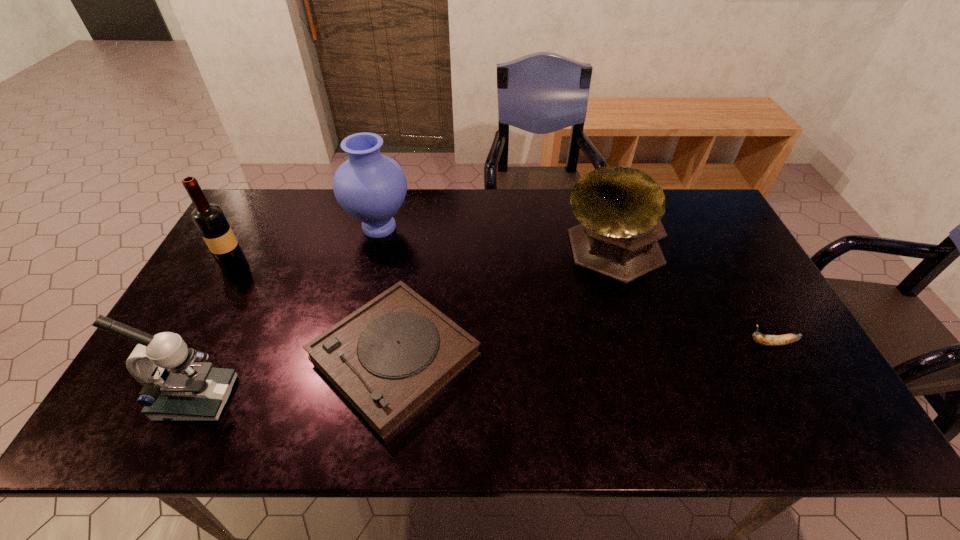
You are a GUI agent. You are given a task and a screenshot of the screen. Output one action in this format:
    pyautogui.click(x=<x>, y=<y>)
    Task: Click on the microscope that is at the left edge
    
    Given the screenshot: What is the action you would take?
    pyautogui.click(x=175, y=388)

The width and height of the screenshot is (960, 540). Identify the location of object at the right edge. (768, 340).

Find the location of a particular element. The width and height of the screenshot is (960, 540). object situated at the near left corner is located at coordinates (175, 388).

Image resolution: width=960 pixels, height=540 pixels. I want to click on vacant space at the far edge, so click(x=444, y=192).

In the image, there is a desktop. Find the location of `vacant space at the near edge`. vacant space at the near edge is located at coordinates (216, 441).

This screenshot has height=540, width=960. What are the coordinates of `vacant space at the left edge of the desktop` in the screenshot? It's located at (199, 298).

Find the location of a particular element. This screenshot has width=960, height=540. vacant point at the right edge is located at coordinates (757, 347).

Where is `vacant space at the far left corner of the desktop`? vacant space at the far left corner of the desktop is located at coordinates (257, 219).

Image resolution: width=960 pixels, height=540 pixels. I want to click on free space at the near left corner of the desktop, so click(x=159, y=435).

Where is `vacant space that is in between the microscope and the banana`? vacant space that is in between the microscope and the banana is located at coordinates (484, 371).